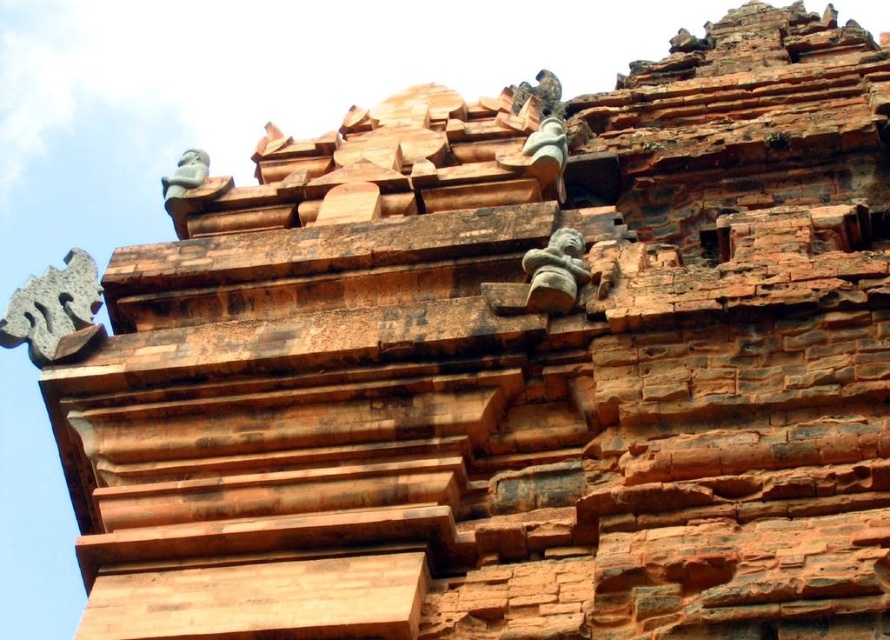
Does gray stone dragon at left have a larger size compared to smooth stone figure at upper left?

Actually, gray stone dragon at left might be smaller than smooth stone figure at upper left.

Does point (55, 301) come in front of point (197, 154)?

Yes, it is in front of point (197, 154).

At what (x,y) coordinates should I click in order to perform the action: click on gray stone dragon at left. Please return your answer as a coordinate pair (x, y). Looking at the image, I should click on (55, 312).

What do you see at coordinates (55, 312) in the screenshot? I see `gray stone dragon at left` at bounding box center [55, 312].

Is gray stone dragon at left thinner than green stone figure at center?

In fact, gray stone dragon at left might be wider than green stone figure at center.

Describe the element at coordinates (55, 312) in the screenshot. I see `gray stone dragon at left` at that location.

Locate an element on the screen. gray stone dragon at left is located at coordinates (55, 312).

Does green stone figure at center appear over smooth stone figure at upper left?

Actually, green stone figure at center is below smooth stone figure at upper left.

Does green stone figure at center have a lesser width compared to smooth stone figure at upper left?

Correct, green stone figure at center's width is less than smooth stone figure at upper left's.

Where is `green stone figure at center`? green stone figure at center is located at coordinates point(555,273).